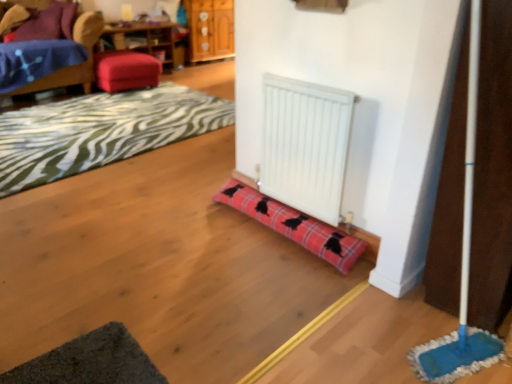
Locate an element on the screen. vacant space underneath white matte radiator at center (from a real-world perspective) is located at coordinates pos(303,209).